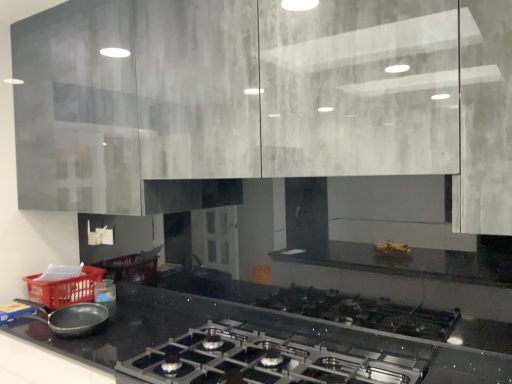
Question: Considering the relative sizes of matte black frying pan at lower left and matte gray cabinets at upper center in the image provided, is matte black frying pan at lower left shorter than matte gray cabinets at upper center?

Choices:
 (A) no
 (B) yes

Answer: (B)

Question: Considering the relative positions of matte black frying pan at lower left and matte gray cabinets at upper center in the image provided, is matte black frying pan at lower left in front of matte gray cabinets at upper center?

Choices:
 (A) no
 (B) yes

Answer: (A)

Question: From a real-world perspective, is matte black frying pan at lower left physically above matte gray cabinets at upper center?

Choices:
 (A) no
 (B) yes

Answer: (A)

Question: Does matte black frying pan at lower left appear on the left side of matte gray cabinets at upper center?

Choices:
 (A) no
 (B) yes

Answer: (B)

Question: Considering the relative sizes of matte black frying pan at lower left and matte gray cabinets at upper center in the image provided, is matte black frying pan at lower left thinner than matte gray cabinets at upper center?

Choices:
 (A) yes
 (B) no

Answer: (A)

Question: Is matte black frying pan at lower left bigger or smaller than satin black gas stove at lower center?

Choices:
 (A) small
 (B) big

Answer: (A)

Question: Considering the positions of matte black frying pan at lower left and satin black gas stove at lower center in the image, is matte black frying pan at lower left wider or thinner than satin black gas stove at lower center?

Choices:
 (A) thin
 (B) wide

Answer: (A)

Question: Would you say matte black frying pan at lower left is to the left or to the right of satin black gas stove at lower center in the picture?

Choices:
 (A) left
 (B) right

Answer: (A)

Question: Is point (49, 317) closer or farther from the camera than point (280, 352)?

Choices:
 (A) farther
 (B) closer

Answer: (A)

Question: Based on their sizes in the image, would you say matte gray cabinets at upper center is bigger or smaller than satin black gas stove at lower center?

Choices:
 (A) small
 (B) big

Answer: (B)

Question: From the image's perspective, relative to satin black gas stove at lower center, is matte gray cabinets at upper center above or below?

Choices:
 (A) below
 (B) above

Answer: (B)

Question: Looking at their shapes, would you say matte gray cabinets at upper center is wider or thinner than satin black gas stove at lower center?

Choices:
 (A) thin
 (B) wide

Answer: (A)

Question: Relative to satin black gas stove at lower center, is matte gray cabinets at upper center in front or behind?

Choices:
 (A) behind
 (B) front

Answer: (A)

Question: Considering the positions of matte black frying pan at lower left and matte gray cabinets at upper center in the image, is matte black frying pan at lower left taller or shorter than matte gray cabinets at upper center?

Choices:
 (A) tall
 (B) short

Answer: (B)

Question: Looking at their shapes, would you say matte black frying pan at lower left is wider or thinner than matte gray cabinets at upper center?

Choices:
 (A) wide
 (B) thin

Answer: (B)